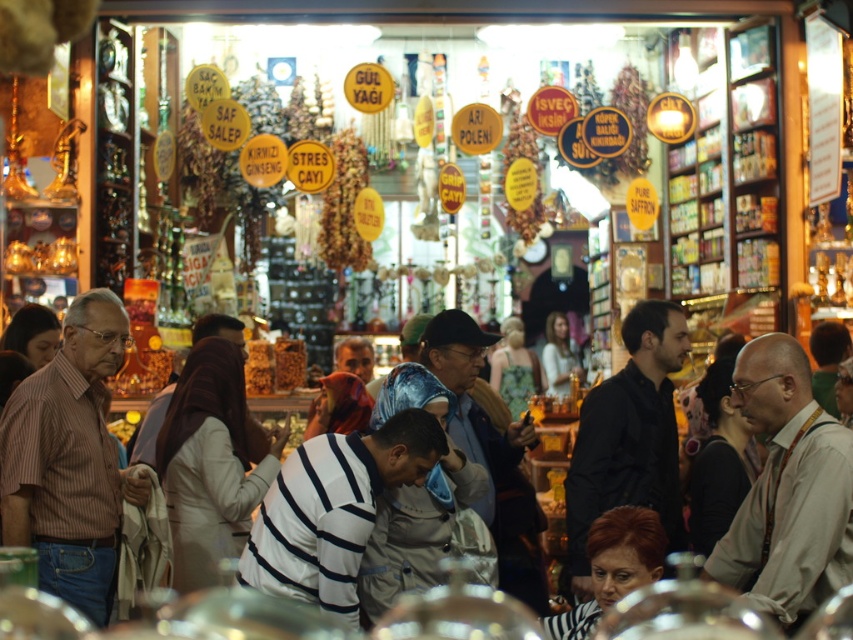
Between white striped shirt at center and striped fabric shirt at center, which one has more height?

Standing taller between the two is striped fabric shirt at center.

In the scene shown: Is white striped shirt at center below striped fabric shirt at center?

Indeed, white striped shirt at center is positioned under striped fabric shirt at center.

Is point (367, 481) farther from camera compared to point (212, 435)?

No.

Find the location of a particular element. Image resolution: width=853 pixels, height=640 pixels. white striped shirt at center is located at coordinates (334, 509).

In the scene shown: How much distance is there between white striped shirt at center and dark brown hair at lower center?

white striped shirt at center and dark brown hair at lower center are 14.28 meters apart from each other.

Is white striped shirt at center to the right of dark brown hair at lower center from the viewer's perspective?

In fact, white striped shirt at center is to the left of dark brown hair at lower center.

This screenshot has height=640, width=853. Find the location of `white striped shirt at center`. white striped shirt at center is located at coordinates (334, 509).

Can you confirm if black shirt at center is taller than striped fabric shirt at center?

Indeed, black shirt at center has a greater height compared to striped fabric shirt at center.

Can you confirm if black shirt at center is positioned above striped fabric shirt at center?

Correct, black shirt at center is located above striped fabric shirt at center.

Is point (630, 310) less distant than point (204, 476)?

No, it is behind (204, 476).

Identify the location of black shirt at center. pyautogui.click(x=630, y=436).